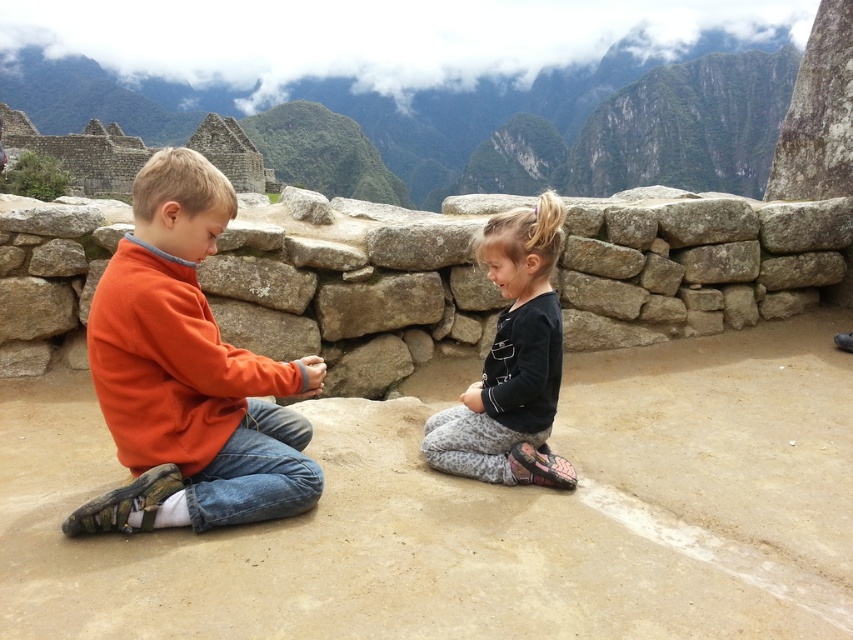
Based on the scene description, where is the rough stone wall at center located in terms of coordinates?

The rough stone wall at center is located at coordinates [351,284].

You are standing at the base of the rugged stone wall at upper center and want to throw a ball to a friend who is 291.48 meters away. Can you reach them if the maximum throwing distance you can achieve is 300 meters?

The distance between you and your friend is exactly 291.48 meters. Since your maximum throwing distance is 300 meters, which is greater than 291.48 meters, you can successfully throw the ball to your friend.

You are a photographer trying to capture a clear shot of the rough stone wall at center and the black matte shirt at center. According to the scene, which object is positioned farther away from the camera?

The black matte shirt at center is behind the rough stone wall at center, so it is farther away from the camera.